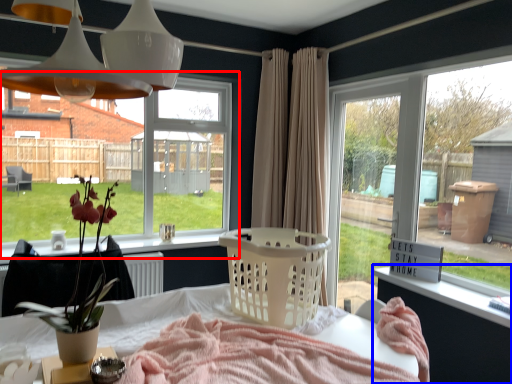
Question: Which point is further to the camera, window (highlighted by a red box) or changing table (highlighted by a blue box)?

Choices:
 (A) window
 (B) changing table

Answer: (A)